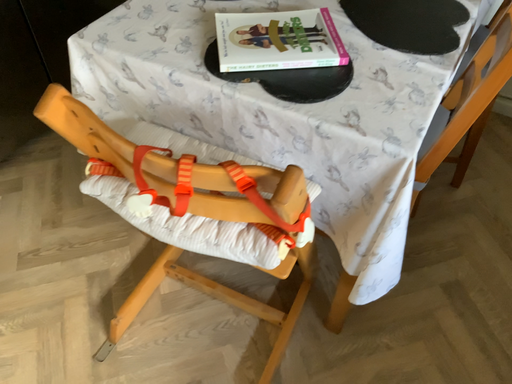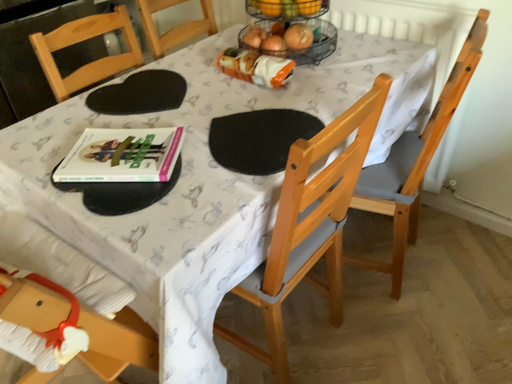
Question: Which way did the camera rotate in the video?

Choices:
 (A) rotated right
 (B) rotated left

Answer: (B)